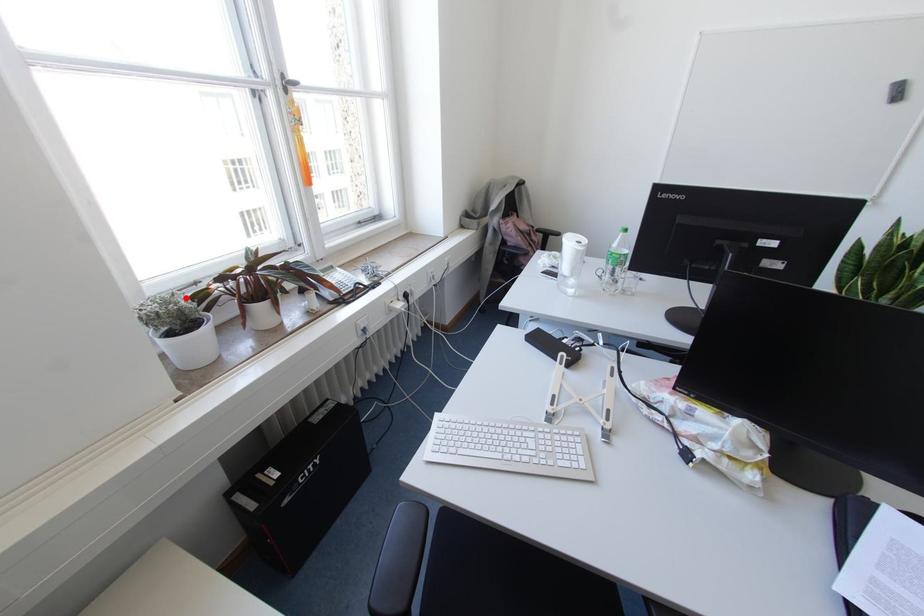
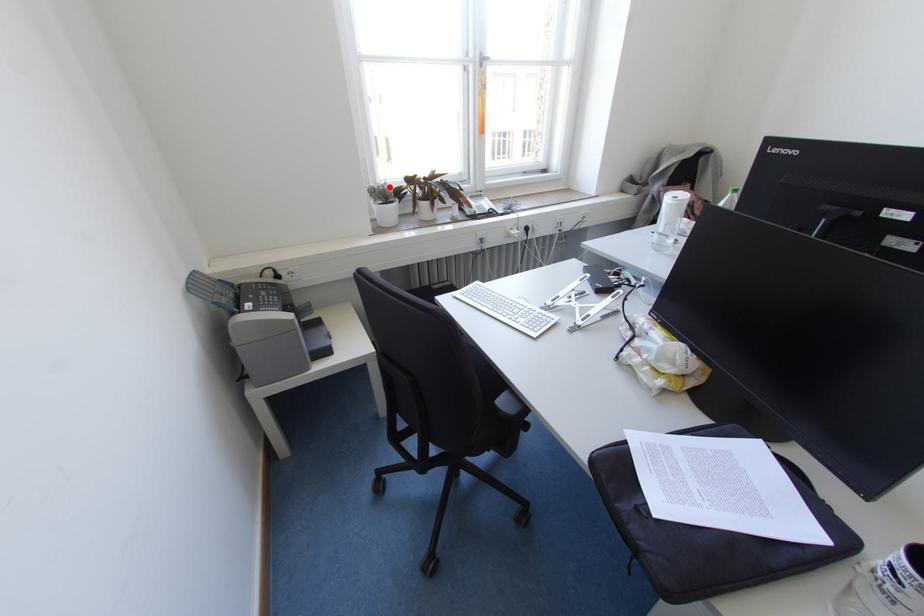
I am providing you with two images of the same scene from different viewpoints. A red point is marked on the first image and another point is marked on the second image. Are the points marked in image1 and image2 representing the same 3D position?

Yes